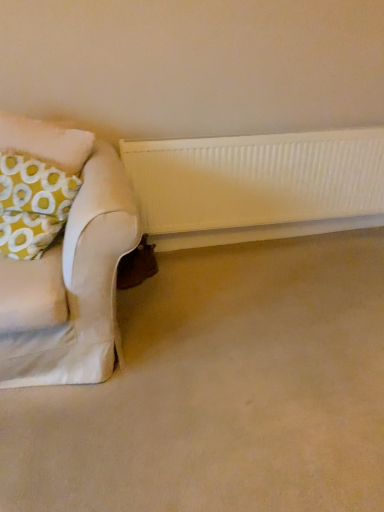
What do you see at coordinates (257, 186) in the screenshot? I see `white ribbed radiator at center` at bounding box center [257, 186].

What do you see at coordinates (221, 390) in the screenshot?
I see `beige carpet at lower center` at bounding box center [221, 390].

What are the coordinates of `white textured radiator at lower center` in the screenshot? It's located at (260, 232).

Find the location of a particular element. white ribbed radiator at center is located at coordinates (257, 186).

Between beige carpet at lower center and white textured radiator at lower center, which one has less height?

Standing shorter between the two is beige carpet at lower center.

From the image's perspective, is beige carpet at lower center under white textured radiator at lower center?

Yes, from the image's perspective, beige carpet at lower center is below white textured radiator at lower center.

Does point (156, 462) come farther from viewer compared to point (206, 233)?

No, it is not.

Is point (127, 147) positioned before point (254, 234)?

That is True.

From a real-world perspective, is white ribbed radiator at center positioned over white textured radiator at lower center based on gravity?

Yes, from a real-world perspective, white ribbed radiator at center is over white textured radiator at lower center

Which of these two, white ribbed radiator at center or white textured radiator at lower center, is wider?

With larger width is white ribbed radiator at center.

Would you say white ribbed radiator at center is outside white textured radiator at lower center?

Yes.

Is the surface of yellow fabric pillow at left in direct contact with beige carpet at lower center?

No, yellow fabric pillow at left is not next to beige carpet at lower center.

Is yellow fabric pillow at left at the left side of beige carpet at lower center?

Correct, you'll find yellow fabric pillow at left to the left of beige carpet at lower center.

The image size is (384, 512). I want to click on throw pillow that is behind the beige carpet at lower center, so click(x=32, y=204).

Is white textured radiator at lower center turned away from yellow fabric pillow at left?

No.

Which object is further away from the camera taking this photo, white textured radiator at lower center or yellow fabric pillow at left?

white textured radiator at lower center is more distant.

From the image's perspective, between white textured radiator at lower center and yellow fabric pillow at left, which one is located above?

yellow fabric pillow at left.

Does white textured radiator at lower center have a lesser height compared to yellow fabric pillow at left?

Yes.

Looking at this image, can you confirm if yellow fabric pillow at left is smaller than white ribbed radiator at center?

No.

Considering the sizes of objects yellow fabric pillow at left and white ribbed radiator at center in the image provided, who is taller, yellow fabric pillow at left or white ribbed radiator at center?

Standing taller between the two is white ribbed radiator at center.

Find the location of a particular element. The height and width of the screenshot is (512, 384). radiator directly beneath the yellow fabric pillow at left (from a real-world perspective) is located at coordinates (257, 186).

Is white ribbed radiator at center far away from beige carpet at lower center?

white ribbed radiator at center is near beige carpet at lower center, not far away.

Is white ribbed radiator at center in front of or behind beige carpet at lower center in the image?

Visually, white ribbed radiator at center is located behind beige carpet at lower center.

Does point (269, 177) come closer to viewer compared to point (197, 259)?

Yes, it is.

How many degrees apart are the facing directions of white ribbed radiator at center and beige carpet at lower center?

The angular difference between white ribbed radiator at center and beige carpet at lower center is 89.9 degrees.

Is point (328, 223) positioned in front of point (161, 379)?

No, (328, 223) is behind (161, 379).

Considering the sizes of objects white textured radiator at lower center and beige carpet at lower center in the image provided, who is thinner, white textured radiator at lower center or beige carpet at lower center?

Thinner between the two is white textured radiator at lower center.

Which object is positioned more to the left, white textured radiator at lower center or beige carpet at lower center?

beige carpet at lower center.

From a real-world perspective, is white textured radiator at lower center above or below beige carpet at lower center?

From a real-world perspective, white textured radiator at lower center is physically above beige carpet at lower center.

You are a GUI agent. You are given a task and a screenshot of the screen. Output one action in this format:
    pyautogui.click(x=<x>, y=<y>)
    Task: Click on the window sill lying above the beige carpet at lower center (from the image's perspective)
    The height and width of the screenshot is (512, 384).
    Given the screenshot: What is the action you would take?
    pyautogui.click(x=260, y=232)

Image resolution: width=384 pixels, height=512 pixels. I want to click on window sill on the right side of white ribbed radiator at center, so click(x=260, y=232).

Based on their spatial positions, is yellow fabric pillow at left or white textured radiator at lower center closer to white ribbed radiator at center?

white textured radiator at lower center is positioned closer to the anchor white ribbed radiator at center.

From the image, which object appears to be farther from beige carpet at lower center, white textured radiator at lower center or yellow fabric pillow at left?

Among the two, white textured radiator at lower center is located further to beige carpet at lower center.

Considering their positions, is yellow fabric pillow at left positioned closer to beige carpet at lower center than white textured radiator at lower center?

yellow fabric pillow at left.

Estimate the real-world distances between objects in this image. Which object is further from yellow fabric pillow at left, white textured radiator at lower center or beige carpet at lower center?

white textured radiator at lower center is positioned further to the anchor yellow fabric pillow at left.

Looking at the image, which one is located further to white textured radiator at lower center, white ribbed radiator at center or yellow fabric pillow at left?

yellow fabric pillow at left is further to white textured radiator at lower center.

Which object lies further to the anchor point white textured radiator at lower center, beige carpet at lower center or white ribbed radiator at center?

Among the two, beige carpet at lower center is located further to white textured radiator at lower center.

Based on their spatial positions, is white ribbed radiator at center or white textured radiator at lower center further from yellow fabric pillow at left?

white textured radiator at lower center lies further to yellow fabric pillow at left than the other object.

From the image, which object appears to be farther from beige carpet at lower center, white textured radiator at lower center or white ribbed radiator at center?

white textured radiator at lower center is positioned further to the anchor beige carpet at lower center.

The image size is (384, 512). Identify the location of throw pillow between beige carpet at lower center and white textured radiator at lower center in the front-back direction. (32, 204).

At what (x,y) coordinates should I click in order to perform the action: click on plain situated between yellow fabric pillow at left and white ribbed radiator at center from left to right. Please return your answer as a coordinate pair (x, y). The width and height of the screenshot is (384, 512). Looking at the image, I should click on (221, 390).

Where is `radiator situated between yellow fabric pillow at left and white textured radiator at lower center from left to right`? This screenshot has height=512, width=384. radiator situated between yellow fabric pillow at left and white textured radiator at lower center from left to right is located at coordinates (257, 186).

This screenshot has width=384, height=512. Identify the location of radiator between beige carpet at lower center and white textured radiator at lower center along the z-axis. (257, 186).